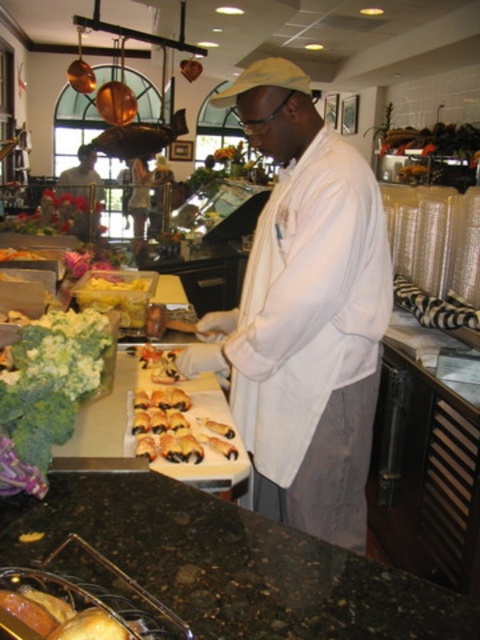
Question: Among these points, which one is farthest from the camera?

Choices:
 (A) (342, 148)
 (B) (95, 636)
 (C) (63, 176)
 (D) (92, 513)

Answer: (C)

Question: Is granite countertop at lower center thinner than matte orange cheese at center?

Choices:
 (A) no
 (B) yes

Answer: (A)

Question: Is white matte chef coat at center to the right of golden brown bread at lower left from the viewer's perspective?

Choices:
 (A) no
 (B) yes

Answer: (B)

Question: Can you confirm if white matte chef coat at center is positioned to the left of matte orange cheese at center?

Choices:
 (A) yes
 (B) no

Answer: (B)

Question: Which point is farther from the camera taking this photo?

Choices:
 (A) (92, 632)
 (B) (99, 285)
 (C) (369, 381)
 (D) (97, 214)

Answer: (D)

Question: Among these points, which one is nearest to the camera?

Choices:
 (A) (100, 195)
 (B) (84, 632)

Answer: (B)